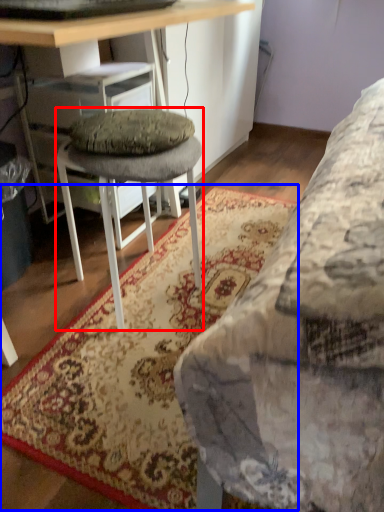
Question: Which of the following is the closest to the observer, stool (highlighted by a red box) or mat (highlighted by a blue box)?

Choices:
 (A) stool
 (B) mat

Answer: (B)